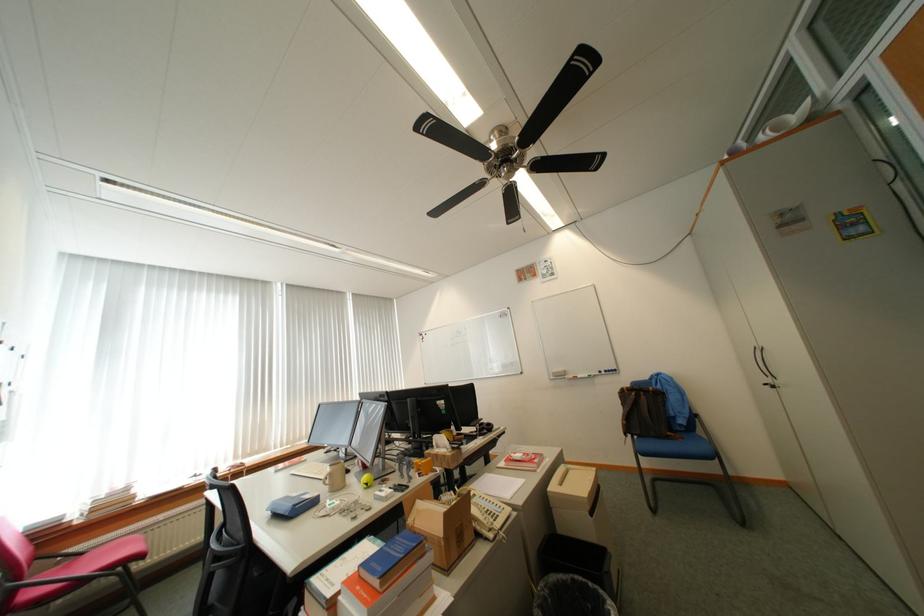
This screenshot has height=616, width=924. Identify the location of blue chair sitting surface. pos(676,447).